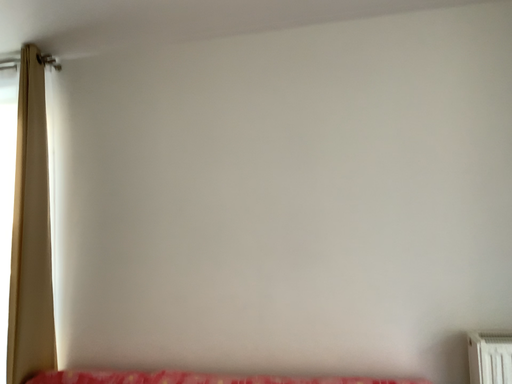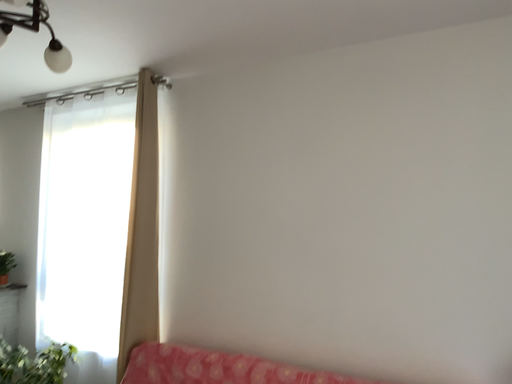
Question: How did the camera likely rotate when shooting the video?

Choices:
 (A) rotated left
 (B) rotated right

Answer: (A)